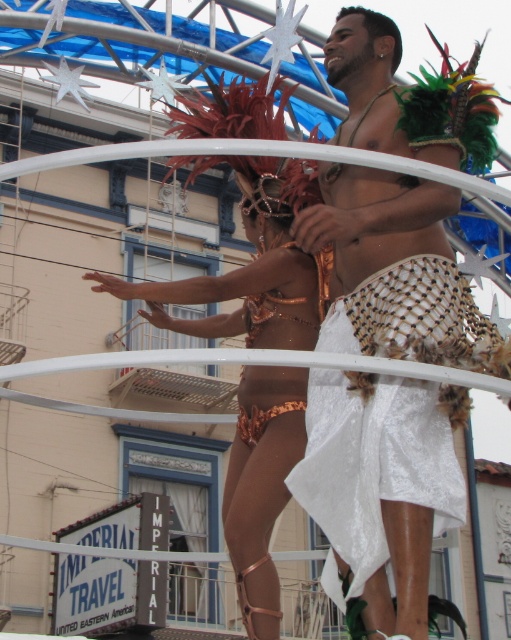
From the picture: Is white mesh skirt at center bigger than copper metallic bikini at center?

Incorrect, white mesh skirt at center is not larger than copper metallic bikini at center.

Is white mesh skirt at center positioned behind copper metallic bikini at center?

No, white mesh skirt at center is closer to the viewer.

Identify the location of white mesh skirt at center. The width and height of the screenshot is (511, 640). (397, 269).

Image resolution: width=511 pixels, height=640 pixels. I want to click on white mesh skirt at center, so click(x=397, y=269).